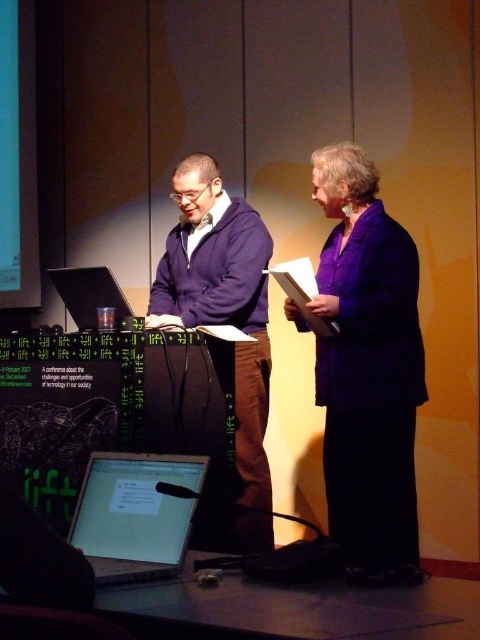
Can you confirm if purple fleece jacket at center is positioned to the right of shiny silver laptop at lower left?

Yes, purple fleece jacket at center is to the right of shiny silver laptop at lower left.

Find the location of a particular element. Image resolution: width=480 pixels, height=640 pixels. purple fleece jacket at center is located at coordinates tap(224, 316).

Describe the element at coordinates (224, 316) in the screenshot. I see `purple fleece jacket at center` at that location.

I want to click on purple fleece jacket at center, so click(224, 316).

Can you confirm if purple fabric jacket at center is positioned above shiny silver laptop at lower left?

Indeed, purple fabric jacket at center is positioned over shiny silver laptop at lower left.

Between point (380, 257) and point (96, 484), which one is positioned behind?

The point (380, 257) is behind.

Measure the distance between point [382,492] and camera.

Point [382,492] and camera are 8.84 feet apart.

Locate an element on the screen. The width and height of the screenshot is (480, 640). purple fabric jacket at center is located at coordinates click(x=368, y=371).

Does purple fabric jacket at center appear under purple fleece jacket at center?

No.

Does purple fabric jacket at center have a lesser width compared to purple fleece jacket at center?

Yes.

Which is behind, point (327, 428) or point (165, 289)?

Point (165, 289)

At what (x,y) coordinates should I click in order to perform the action: click on purple fabric jacket at center. Please return your answer as a coordinate pair (x, y). Image resolution: width=480 pixels, height=640 pixels. Looking at the image, I should click on (368, 371).